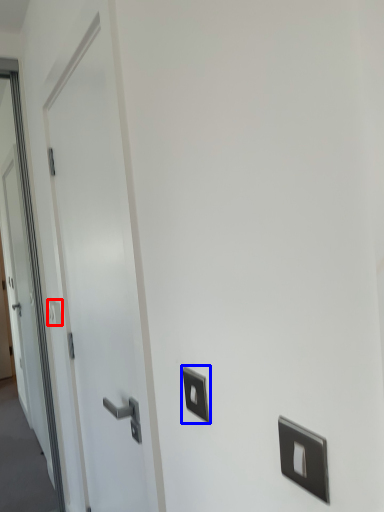
Question: Which object is further to the camera taking this photo, light switch (highlighted by a red box) or light switch (highlighted by a blue box)?

Choices:
 (A) light switch
 (B) light switch

Answer: (A)